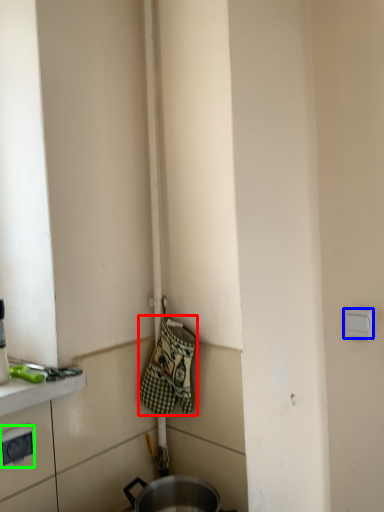
Question: Estimate the real-world distances between objects in this image. Which object is farther from blanket (highlighted by a red box), electric outlet (highlighted by a blue box) or electric outlet (highlighted by a green box)?

Choices:
 (A) electric outlet
 (B) electric outlet

Answer: (A)